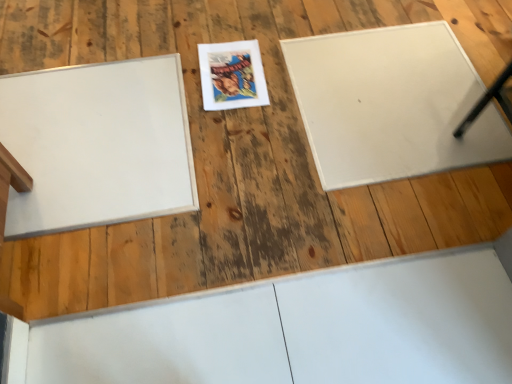
This screenshot has height=384, width=512. I want to click on empty space that is to the right of matte paper comic book at center, so click(302, 75).